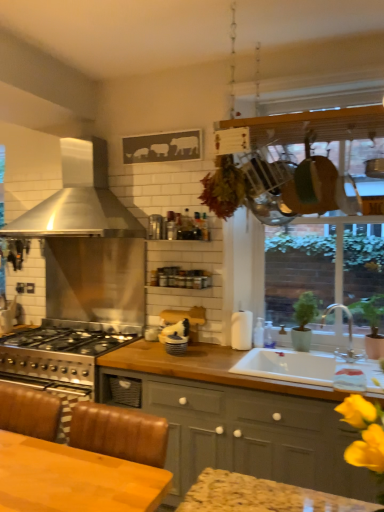
Where is `vacant area that lies to the right of white paper towel dispenser at center, arranged as the third appliance when viewed from the left`? The height and width of the screenshot is (512, 384). vacant area that lies to the right of white paper towel dispenser at center, arranged as the third appliance when viewed from the left is located at coordinates (273, 347).